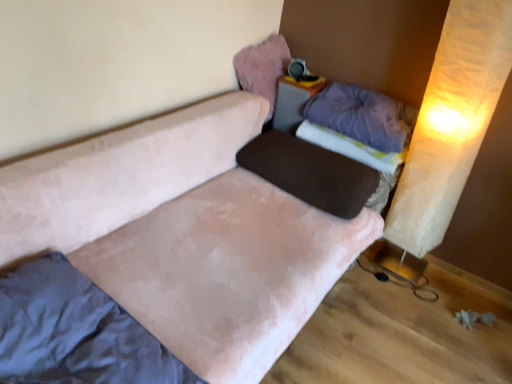
Question: Does velvet pink couch at center have a greater width compared to matte plastic table at upper center?

Choices:
 (A) yes
 (B) no

Answer: (A)

Question: Is velvet pink couch at center positioned with its back to matte plastic table at upper center?

Choices:
 (A) no
 (B) yes

Answer: (A)

Question: From a real-world perspective, is velvet pink couch at center located higher than matte plastic table at upper center?

Choices:
 (A) yes
 (B) no

Answer: (B)

Question: Is velvet pink couch at center positioned in front of matte plastic table at upper center?

Choices:
 (A) yes
 (B) no

Answer: (A)

Question: Can you confirm if velvet pink couch at center is taller than matte plastic table at upper center?

Choices:
 (A) yes
 (B) no

Answer: (A)

Question: Is velvet pink couch at center aimed at matte plastic table at upper center?

Choices:
 (A) no
 (B) yes

Answer: (A)

Question: Is velvet pink couch at center wider than purple soft pillow at upper right, the 2th pillow ordered from the bottom?

Choices:
 (A) no
 (B) yes

Answer: (B)

Question: Considering the relative sizes of velvet pink couch at center and purple soft pillow at upper right, the 2th pillow ordered from the bottom, in the image provided, is velvet pink couch at center taller than purple soft pillow at upper right, the 2th pillow ordered from the bottom,?

Choices:
 (A) yes
 (B) no

Answer: (A)

Question: Does velvet pink couch at center have a lesser height compared to purple soft pillow at upper right, which appears as the 2th pillow when viewed from the top?

Choices:
 (A) yes
 (B) no

Answer: (B)

Question: Can you confirm if velvet pink couch at center is thinner than purple soft pillow at upper right, which appears as the 2th pillow when viewed from the top?

Choices:
 (A) no
 (B) yes

Answer: (A)

Question: Is purple soft pillow at upper right, the 2th pillow ordered from the bottom, a part of velvet pink couch at center?

Choices:
 (A) yes
 (B) no

Answer: (B)

Question: Is velvet pink couch at center smaller than purple soft pillow at upper right, which appears as the 2th pillow when viewed from the top?

Choices:
 (A) yes
 (B) no

Answer: (B)

Question: From the image's perspective, does purple soft pillow at upper right, the 2th pillow ordered from the bottom, appear higher than matte plastic table at upper center?

Choices:
 (A) yes
 (B) no

Answer: (B)